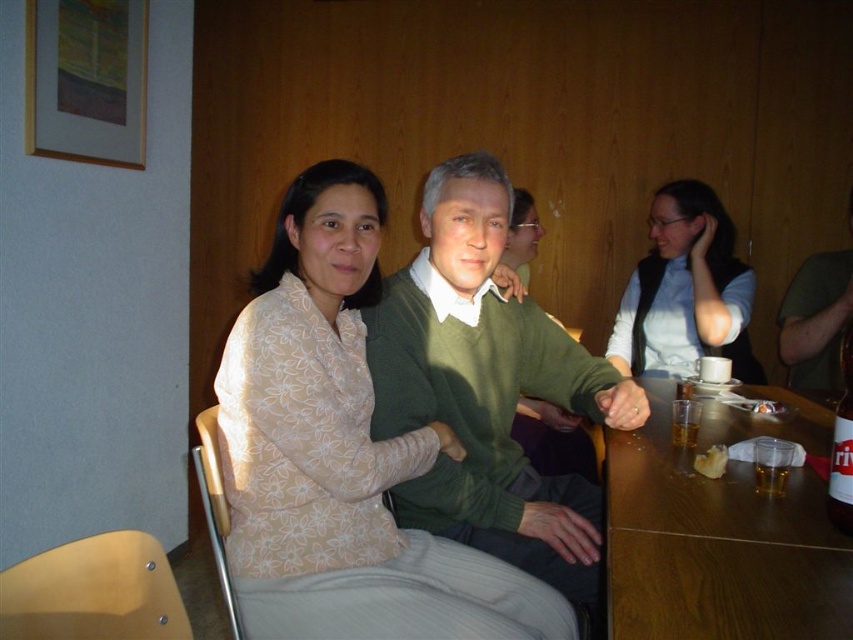
Question: Which object appears closest to the camera in this image?

Choices:
 (A) green sweater at center
 (B) translucent plastic cup at table right

Answer: (B)

Question: Which is farther from the white matte vest at upper right?

Choices:
 (A) translucent glass beer at table right
 (B) green sweater at center

Answer: (A)

Question: Can you confirm if white floral sweater at center is positioned below green sweater at center?

Choices:
 (A) yes
 (B) no

Answer: (A)

Question: Estimate the real-world distances between objects in this image. Which object is farther from the green sweater at center?

Choices:
 (A) translucent glass beer at table right
 (B) translucent plastic cup at table right
 (C) white floral sweater at center

Answer: (B)

Question: Is white floral sweater at center positioned before translucent plastic cup at table right?

Choices:
 (A) yes
 (B) no

Answer: (A)

Question: Is wooden table at lower right closer to the viewer compared to translucent plastic cup at table right?

Choices:
 (A) yes
 (B) no

Answer: (A)